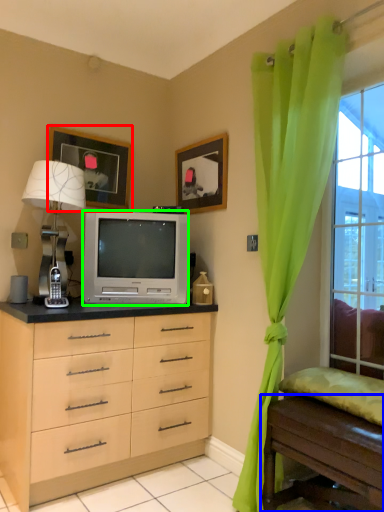
Question: Which object is the closest to the picture frame (highlighted by a red box)? Choose among these: table (highlighted by a blue box) or television (highlighted by a green box).

Choices:
 (A) table
 (B) television

Answer: (B)